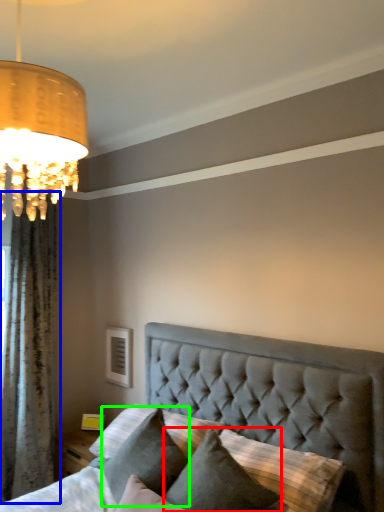
Question: Based on their relative distances, which object is nearer to pillow (highlighted by a red box)? Choose from curtain (highlighted by a blue box) and pillow (highlighted by a green box).

Choices:
 (A) curtain
 (B) pillow

Answer: (B)